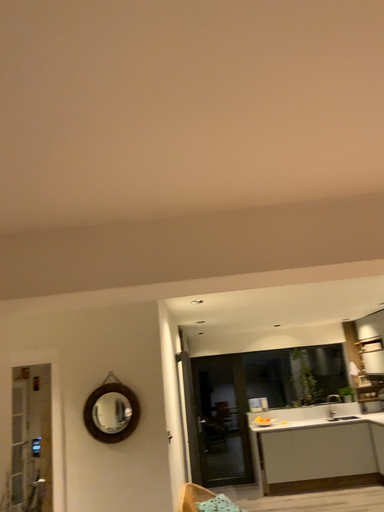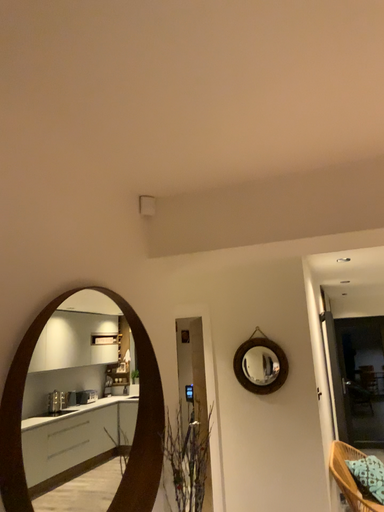
Question: Which way did the camera rotate in the video?

Choices:
 (A) rotated right
 (B) rotated left

Answer: (B)